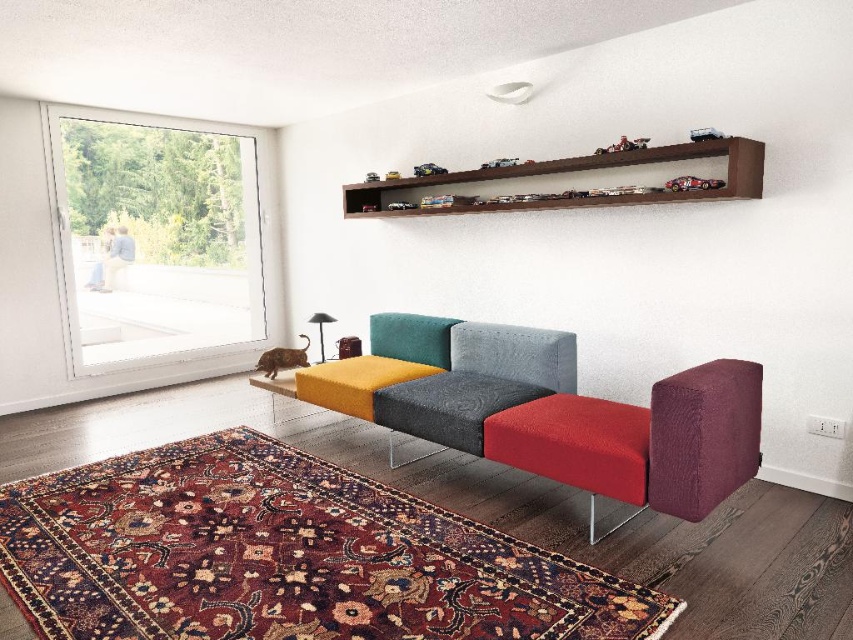
Between point (143, 260) and point (572, 168), which one is positioned behind?

Point (143, 260)

Who is more forward, (73, 204) or (714, 193)?

Point (714, 193) is in front.

Find the location of `transparent glass door at left`. transparent glass door at left is located at coordinates (155, 237).